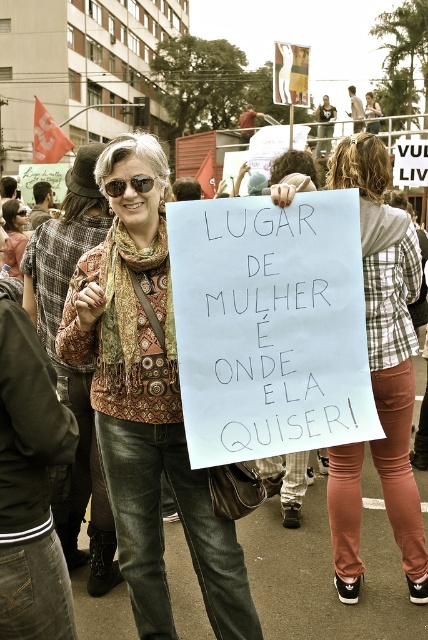
Question: Can you confirm if patterned scarf at center is positioned to the right of sunglasses at center?

Choices:
 (A) yes
 (B) no

Answer: (B)

Question: Which object appears farthest from the camera in this image?

Choices:
 (A) brown leather jacket at center
 (B) patterned scarf at center
 (C) sunglasses at center
 (D) plaid shirt at center

Answer: (A)

Question: Can you confirm if patterned scarf at center is wider than brown leather jacket at center?

Choices:
 (A) yes
 (B) no

Answer: (A)

Question: Is patterned scarf at center smaller than plaid shirt at center?

Choices:
 (A) yes
 (B) no

Answer: (B)

Question: Which object is farther from the camera taking this photo?

Choices:
 (A) sunglasses at center
 (B) plaid shirt at center
 (C) patterned scarf at center

Answer: (B)

Question: Which object appears closest to the camera in this image?

Choices:
 (A) patterned scarf at center
 (B) sunglasses at center
 (C) plaid shirt at center

Answer: (A)